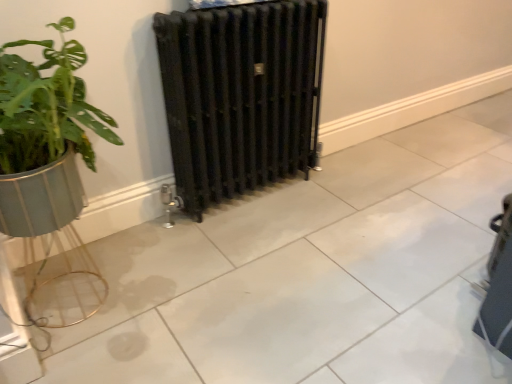
The height and width of the screenshot is (384, 512). Describe the element at coordinates (240, 95) in the screenshot. I see `black cast iron radiator at center` at that location.

Image resolution: width=512 pixels, height=384 pixels. I want to click on black cast iron radiator at center, so click(240, 95).

Locate an element on the screen. This screenshot has height=384, width=512. black cast iron radiator at center is located at coordinates (240, 95).